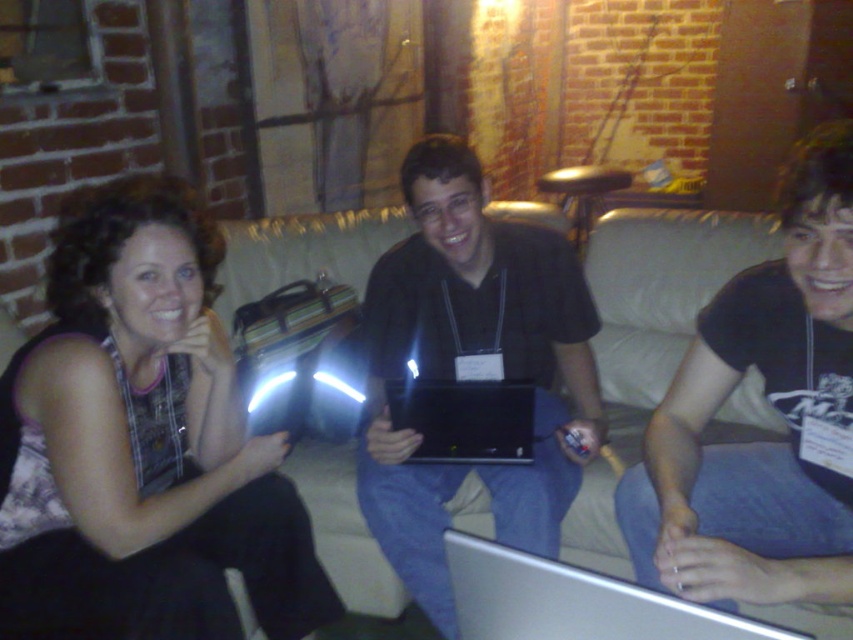
Based on the photo, you are a guest at this gathering and need to place your matte black purse at left on the couch without covering the black matte laptop at center. Is the purse shorter than the laptop?

The matte black purse at left is shorter than the black matte laptop at center, so it can be placed without covering the laptop as it is smaller in height.

You are a guest at this gathering and need to place your matte black purse at left and black matte laptop at center on the couch. Based on their positions, which item is closer to the floor?

The matte black purse at left is closer to the floor because it is positioned below the black matte laptop at center.

You are taking a photo of the silver metallic laptop at lower center and the black cotton shirt at center right. Which object will appear closer to the camera in the photo?

The black cotton shirt at center right will appear closer to the camera in the photo because the silver metallic laptop at lower center is behind it.